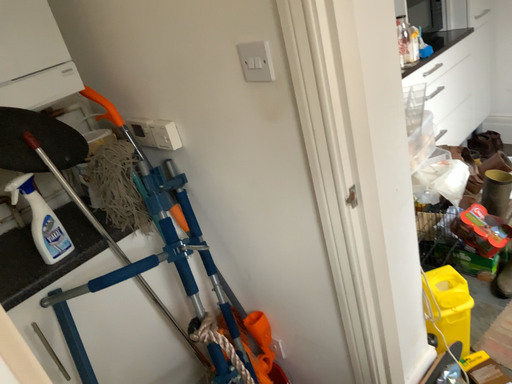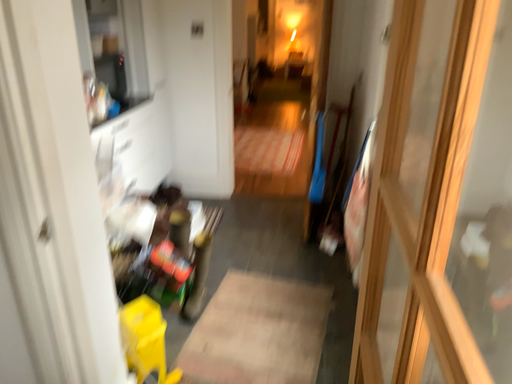
Question: How did the camera likely rotate when shooting the video?

Choices:
 (A) rotated left
 (B) rotated right

Answer: (B)